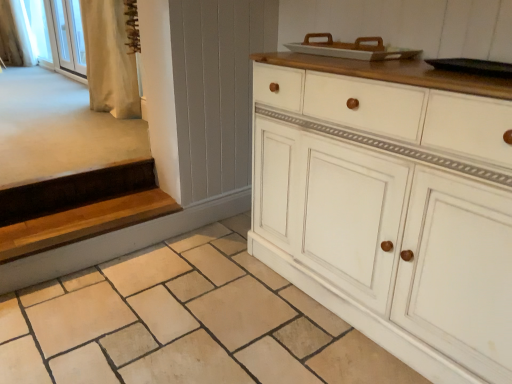
Find the location of a particular element. The image size is (512, 384). vacant space in front of beige fabric curtain at upper left, arranged as the 2th curtain when viewed from the top is located at coordinates (x=84, y=126).